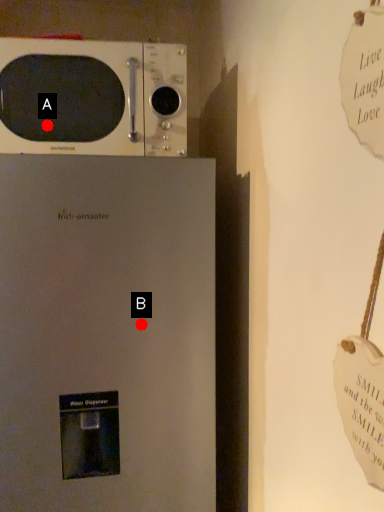
Question: Two points are circled on the image, labeled by A and B beside each circle. Which point is farther to the camera?

Choices:
 (A) A is further
 (B) B is further

Answer: (A)